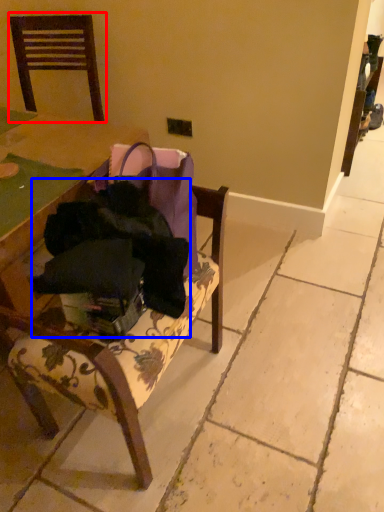
Question: Among these objects, which one is farthest to the camera, chair (highlighted by a red box) or clothing (highlighted by a blue box)?

Choices:
 (A) chair
 (B) clothing

Answer: (A)